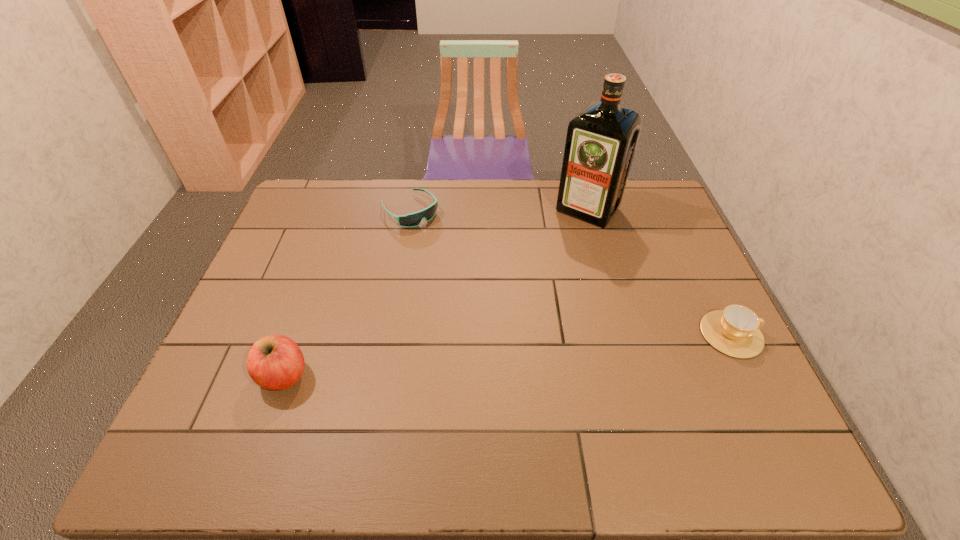
Where is `apple`? apple is located at coordinates (275, 362).

Image resolution: width=960 pixels, height=540 pixels. What are the coordinates of `the second tallest object` in the screenshot? It's located at (275, 362).

Identify the location of cup. The image size is (960, 540). (735, 331).

Identify the location of the tallest object. The width and height of the screenshot is (960, 540). (601, 140).

The height and width of the screenshot is (540, 960). What are the coordinates of `liquor` in the screenshot? It's located at (601, 140).

Where is `the second object from left to right`? Image resolution: width=960 pixels, height=540 pixels. the second object from left to right is located at coordinates (414, 219).

Locate an element on the screen. This screenshot has height=540, width=960. sunglasses is located at coordinates (414, 219).

At what (x,y) coordinates should I click in order to perform the action: click on free space located 0.260m on the right of the third shortest object. Please return your answer as a coordinate pair (x, y). Looking at the image, I should click on (420, 375).

At what (x,y) coordinates should I click in order to perform the action: click on free spot located on the front label of the second object from right to left. Please return your answer as a coordinate pair (x, y). The image size is (960, 540). Looking at the image, I should click on (511, 305).

Locate an element on the screen. vacant space located 0.220m on the front label of the second object from right to left is located at coordinates (541, 266).